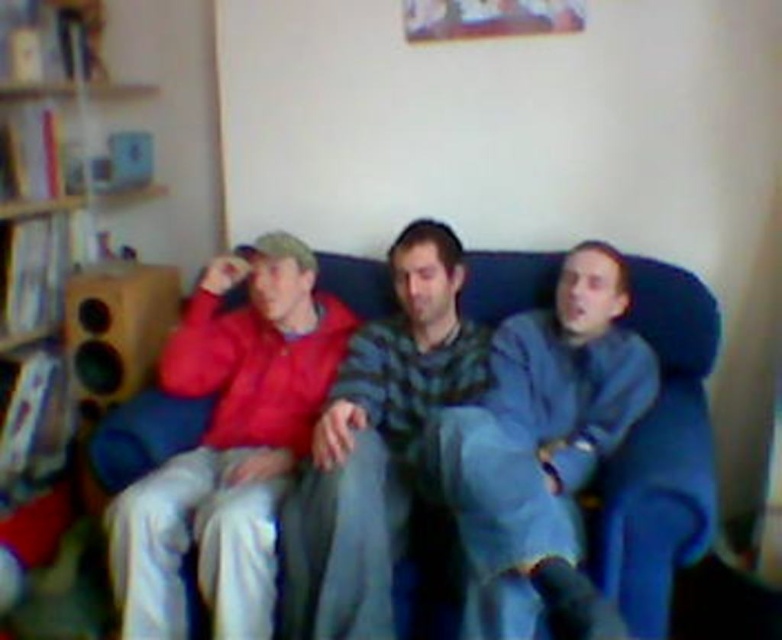
Looking at this image, can you confirm if blue fuzzy blanket at center is positioned above striped sweater at center?

Indeed, blue fuzzy blanket at center is positioned over striped sweater at center.

Describe the element at coordinates (540, 436) in the screenshot. I see `blue fuzzy blanket at center` at that location.

Between point (551, 372) and point (391, 420), which one is positioned behind?

Positioned behind is point (391, 420).

This screenshot has width=782, height=640. I want to click on blue fuzzy blanket at center, so coord(540,436).

Who is more forward, (x=291, y=240) or (x=359, y=282)?

Point (x=291, y=240) is in front.

Can you confirm if matte red jacket at left is bigger than blue fabric couch at center?

Correct, matte red jacket at left is larger in size than blue fabric couch at center.

I want to click on matte red jacket at left, so click(228, 445).

Between matte red jacket at left and blue fuzzy blanket at center, which one has more height?

matte red jacket at left is taller.

Can you confirm if matte red jacket at left is smaller than blue fuzzy blanket at center?

Correct, matte red jacket at left occupies less space than blue fuzzy blanket at center.

Measure the distance between matte red jacket at left and camera.

A distance of 5.96 feet exists between matte red jacket at left and camera.

In order to click on matte red jacket at left in this screenshot , I will do `click(228, 445)`.